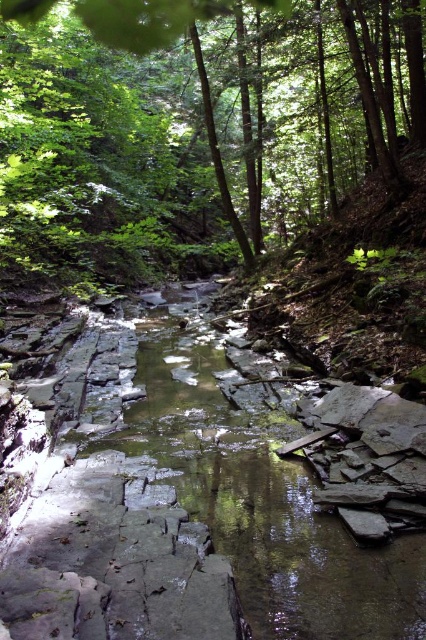
You are a hiker trying to cross the gray stone stream at center. There is a green leafy tree at upper center nearby. Which direction should you head relative to the tree to reach the stream?

The green leafy tree at upper center is positioned on the right side of the gray stone stream at center, so you should head to the left of the tree to reach the stream.

Consider the image. You are a hiker trying to cross the gray stone stream at center. You notice a green leafy tree at upper center nearby. Which one is wider in terms of their spread? Please state the wider one.

The green leafy tree at upper center is wider than the gray stone stream at center.

You are standing at the center of the stream and want to reach the green leafy tree at upper center. In which direction should you walk?

You should walk towards the upper center direction to reach the green leafy tree at upper center.